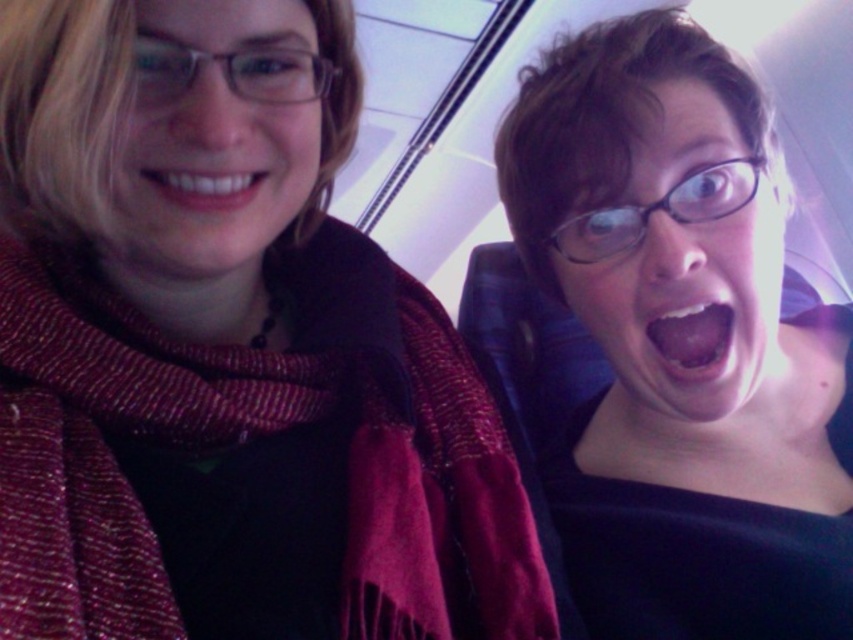
Question: Which point is farther from the camera taking this photo?

Choices:
 (A) coord(676,122)
 (B) coord(682,314)

Answer: (B)

Question: Is matte black glasses at upper center in front of matte black scarf at left?

Choices:
 (A) yes
 (B) no

Answer: (B)

Question: Among these objects, which one is nearest to the camera?

Choices:
 (A) woven wool scarf at left
 (B) black glossy glasses at upper right

Answer: (A)

Question: Does matte black glasses at upper center have a lesser width compared to matte black scarf at left?

Choices:
 (A) yes
 (B) no

Answer: (B)

Question: Which point is farther to the camera?

Choices:
 (A) matte black scarf at left
 (B) woven wool scarf at left

Answer: (A)

Question: Is black glossy glasses at upper right thinner than matte black scarf at left?

Choices:
 (A) yes
 (B) no

Answer: (B)